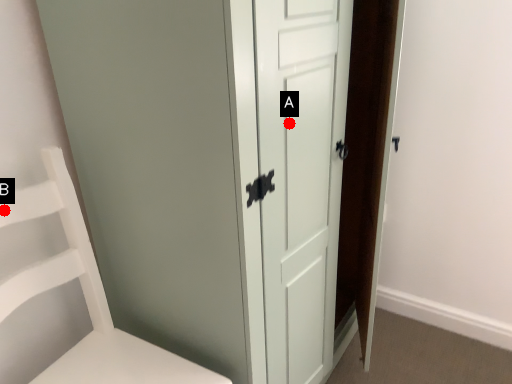
Question: Two points are circled on the image, labeled by A and B beside each circle. Which of the following is the farthest from the observer?

Choices:
 (A) A is further
 (B) B is further

Answer: (B)